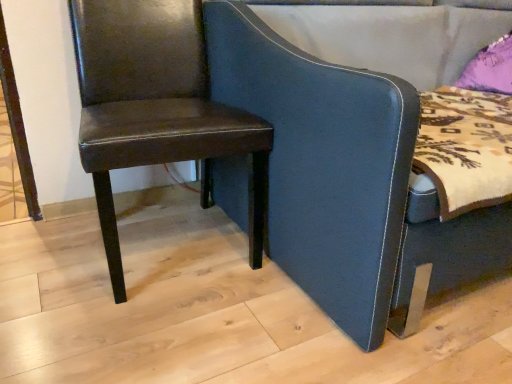
Question: Would you say matte brown leather chair at left, placed as the 1th chair when sorted from left to right, is inside or outside dark blue leather chair at center, which is the 1th chair in right-to-left order?

Choices:
 (A) outside
 (B) inside

Answer: (A)

Question: Looking at their shapes, would you say matte brown leather chair at left, placed as the 1th chair when sorted from left to right, is wider or thinner than dark blue leather chair at center, the 2th chair in the left-to-right sequence?

Choices:
 (A) thin
 (B) wide

Answer: (A)

Question: In terms of height, does matte brown leather chair at left, acting as the 2th chair starting from the right, look taller or shorter compared to dark blue leather chair at center, the 2th chair in the left-to-right sequence?

Choices:
 (A) short
 (B) tall

Answer: (A)

Question: Looking at the image, does dark blue leather chair at center, which is the 1th chair in right-to-left order, seem bigger or smaller compared to matte brown leather chair at left, acting as the 2th chair starting from the right?

Choices:
 (A) big
 (B) small

Answer: (A)

Question: From a real-world perspective, is dark blue leather chair at center, which is the 1th chair in right-to-left order, physically located above or below matte brown leather chair at left, placed as the 1th chair when sorted from left to right?

Choices:
 (A) below
 (B) above

Answer: (B)

Question: Considering the positions of dark blue leather chair at center, which is the 1th chair in right-to-left order, and matte brown leather chair at left, placed as the 1th chair when sorted from left to right, in the image, is dark blue leather chair at center, which is the 1th chair in right-to-left order, taller or shorter than matte brown leather chair at left, placed as the 1th chair when sorted from left to right,?

Choices:
 (A) tall
 (B) short

Answer: (A)

Question: Visually, is dark blue leather chair at center, the 2th chair in the left-to-right sequence, positioned to the left or to the right of matte brown leather chair at left, acting as the 2th chair starting from the right?

Choices:
 (A) left
 (B) right

Answer: (B)